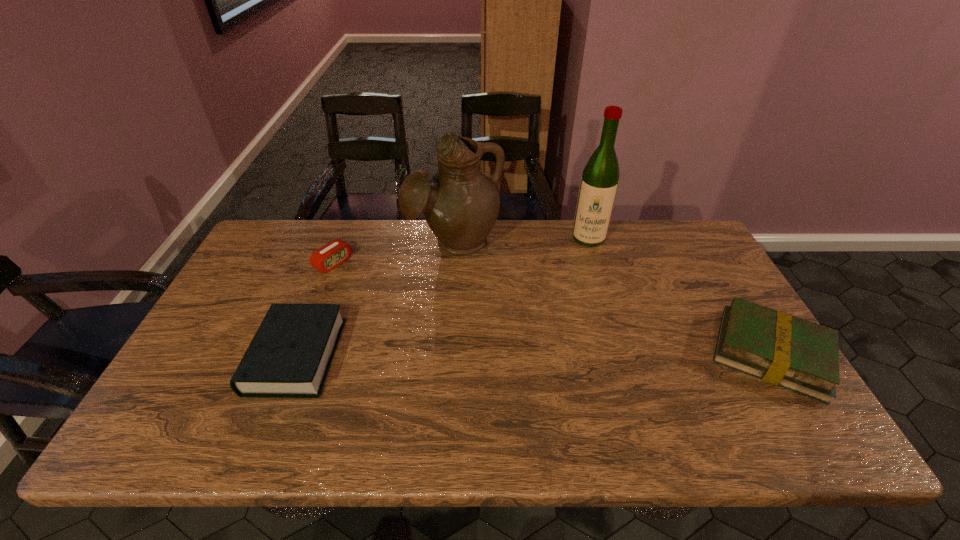
In order to click on free space on the desktop that is between the Bible and the book and is positioned on the label of the second object from right to left in this screenshot , I will do point(580,355).

Identify the location of free space on the desktop that is between the Bible and the book and is positioned at the spout of the second tallest object. This screenshot has height=540, width=960. (489, 355).

I want to click on vacant space on the desktop that is between the Bible and the rightmost object and is positioned on the front-facing side of the alarm clock, so click(x=491, y=355).